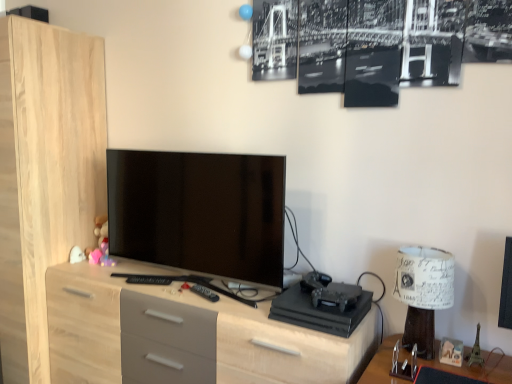
At what (x,y) coordinates should I click in order to perform the action: click on empty space that is ontop of light wood/grey drawers at center (from a real-world perspective). Please return your answer as a coordinate pair (x, y). The width and height of the screenshot is (512, 384). Looking at the image, I should click on (174, 284).